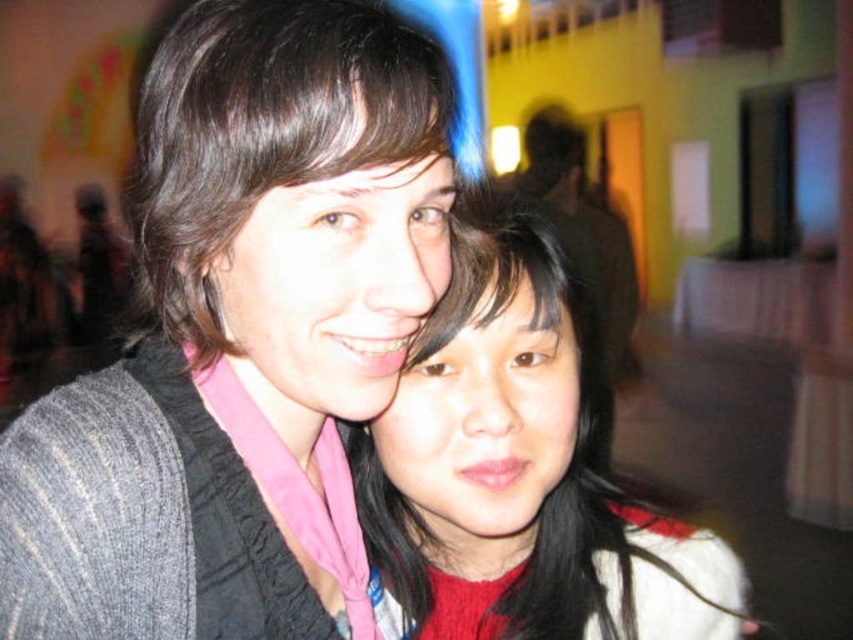
You are a photographer adjusting your camera settings to focus on the two people in the image. Which of the two subjects with black hair, the smooth black hair at center or the matte black hair at upper left, is positioned lower in the frame?

The smooth black hair at center is located below matte black hair at upper left, so the smooth black hair at center is positioned lower in the frame.

You are standing in the room and want to move towards the two points marked in the image. Which point, point (x=9, y=436) or point (x=450, y=378), would you reach first?

Point (x=9, y=436) is closer to the viewer than point (x=450, y=378), so you would reach point (x=9, y=436) first.

In the scene shown: You are a photographer at a social event. You want to take a photo of the two people mentioned in the scene. The gray knitted sweater at upper left and the matte black hair at upper left are both in the frame. Based on their positions, which object is closer to the camera?

The gray knitted sweater at upper left is positioned under matte black hair at upper left, so the matte black hair at upper left is closer to the camera.